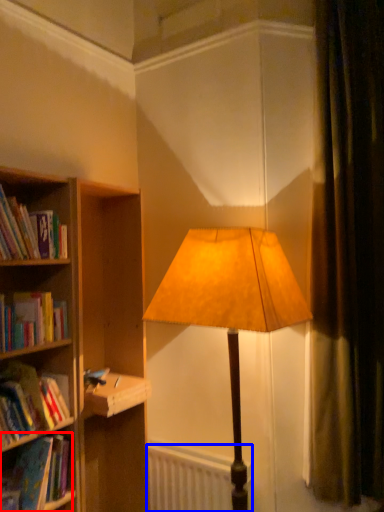
Question: Which object is further to the camera taking this photo, book (highlighted by a red box) or radiator (highlighted by a blue box)?

Choices:
 (A) book
 (B) radiator

Answer: (B)